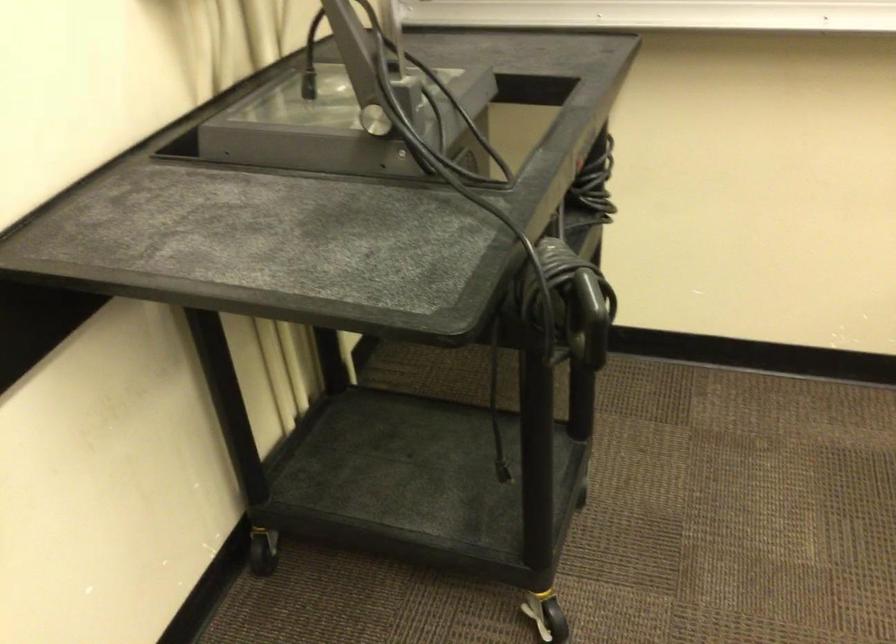
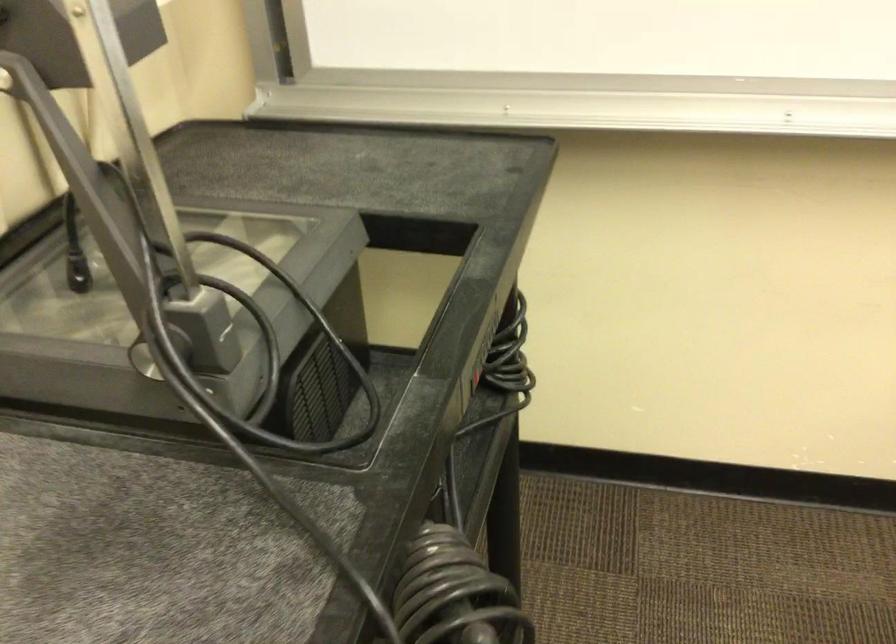
Question: The images are taken continuously from a first-person perspective. In which direction is your viewpoint rotating?

Choices:
 (A) Left
 (B) Right
 (C) Up
 (D) Down

Answer: (B)